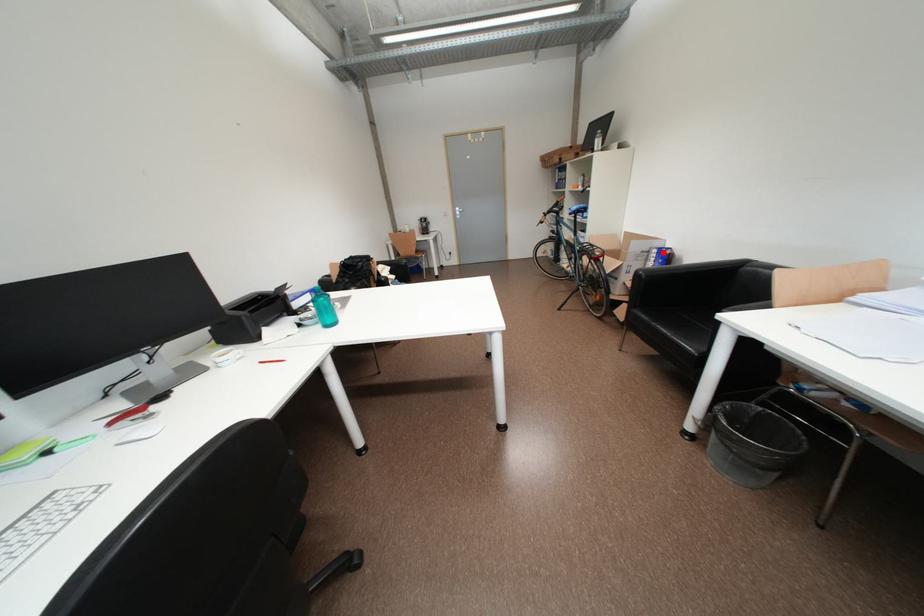
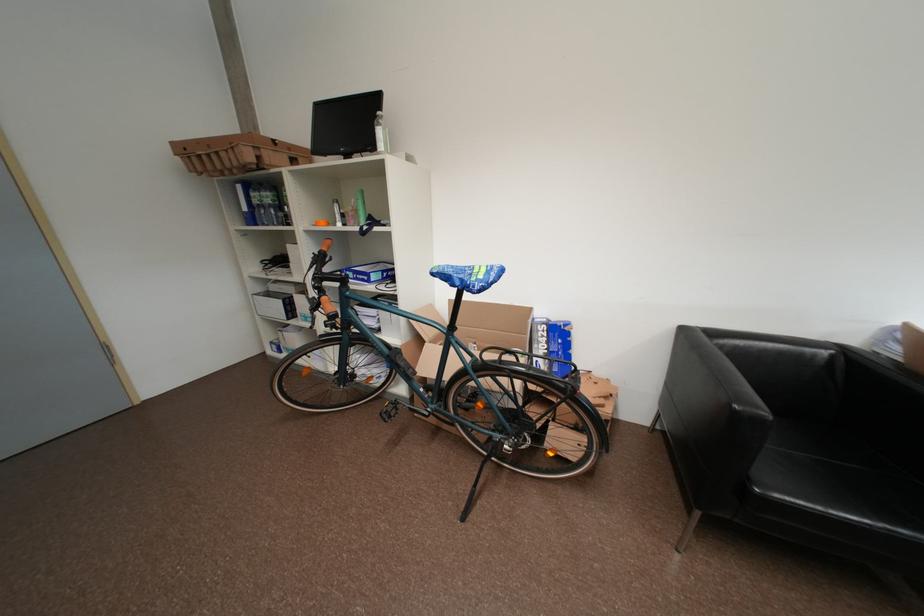
Where in the second image is the point corresponding to the highlighted location from the first image?

(553, 329)